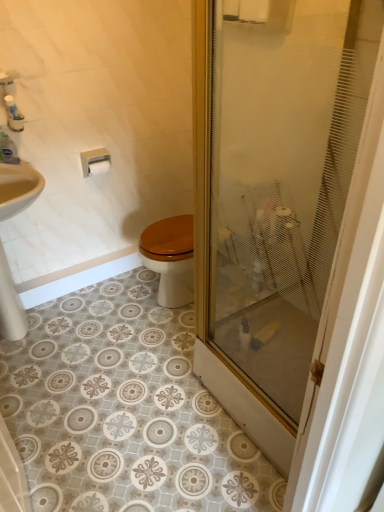
What do you see at coordinates (99, 167) in the screenshot? The width and height of the screenshot is (384, 512). I see `white matte toilet paper at upper left` at bounding box center [99, 167].

Where is `clear plastic bottle at upper left`? Image resolution: width=384 pixels, height=512 pixels. clear plastic bottle at upper left is located at coordinates (8, 150).

The height and width of the screenshot is (512, 384). In order to click on transparent frosted glass at center in this screenshot , I will do [282, 176].

In the image, is white plastic toilet paper holder at upper left positioned in front of or behind transparent frosted glass at center?

white plastic toilet paper holder at upper left is behind transparent frosted glass at center.

From the image's perspective, is white plastic toilet paper holder at upper left located above or below transparent frosted glass at center?

Clearly, from the image's perspective, white plastic toilet paper holder at upper left is above transparent frosted glass at center.

Between point (90, 170) and point (230, 99), which one is positioned behind?

The point (90, 170) is farther from the camera.

Consider the image. Could you tell me if white plastic toilet paper holder at upper left is turned towards transparent frosted glass at center?

Yes, white plastic toilet paper holder at upper left is turned towards transparent frosted glass at center.

From a real-world perspective, relative to white plastic toilet paper holder at upper left, is clear plastic bottle at upper left vertically above or below?

clear plastic bottle at upper left is situated higher than white plastic toilet paper holder at upper left in the real world.

Would you say clear plastic bottle at upper left is a long distance from white plastic toilet paper holder at upper left?

No, clear plastic bottle at upper left is not far from white plastic toilet paper holder at upper left.

In the scene shown: Is clear plastic bottle at upper left located outside white plastic toilet paper holder at upper left?

Yes, clear plastic bottle at upper left is outside of white plastic toilet paper holder at upper left.

Is clear plastic bottle at upper left turned away from white plastic toilet paper holder at upper left?

No, clear plastic bottle at upper left is not facing the opposite direction of white plastic toilet paper holder at upper left.

Consider the image. Does clear plastic bottle at upper left have a larger size compared to transparent frosted glass at center?

No, clear plastic bottle at upper left is not bigger than transparent frosted glass at center.

Is clear plastic bottle at upper left positioned far away from transparent frosted glass at center?

Yes, clear plastic bottle at upper left is far from transparent frosted glass at center.

From a real-world perspective, is clear plastic bottle at upper left over transparent frosted glass at center?

Yes, from a real-world perspective, clear plastic bottle at upper left is over transparent frosted glass at center

Where is `toiletry behind the transparent frosted glass at center`? The height and width of the screenshot is (512, 384). toiletry behind the transparent frosted glass at center is located at coordinates (8, 150).

From a real-world perspective, between transparent frosted glass at center and white plastic toilet paper holder at upper left, who is vertically higher?

From a 3D spatial view, transparent frosted glass at center is above.

Which of these two, transparent frosted glass at center or white plastic toilet paper holder at upper left, is thinner?

Thinner between the two is white plastic toilet paper holder at upper left.

Between transparent frosted glass at center and white plastic toilet paper holder at upper left, which one appears on the left side from the viewer's perspective?

white plastic toilet paper holder at upper left is more to the left.

How much distance is there between clear plastic bottle at upper left and white matte toilet paper at upper left?

clear plastic bottle at upper left and white matte toilet paper at upper left are 18.36 inches apart.

Does clear plastic bottle at upper left have a lesser width compared to white matte toilet paper at upper left?

Incorrect, the width of clear plastic bottle at upper left is not less than that of white matte toilet paper at upper left.

Is clear plastic bottle at upper left situated inside white matte toilet paper at upper left or outside?

clear plastic bottle at upper left is spatially situated outside white matte toilet paper at upper left.

Considering the sizes of objects white matte toilet paper at upper left and transparent frosted glass at center in the image provided, who is taller, white matte toilet paper at upper left or transparent frosted glass at center?

transparent frosted glass at center is taller.

From the image's perspective, is white matte toilet paper at upper left above or below transparent frosted glass at center?

Based on their image positions, white matte toilet paper at upper left is located above transparent frosted glass at center.

At what (x,y) coordinates should I click in order to perform the action: click on toilet paper above the transparent frosted glass at center (from the image's perspective). Please return your answer as a coordinate pair (x, y). The width and height of the screenshot is (384, 512). Looking at the image, I should click on (99, 167).

Which object is thinner, white matte toilet paper at upper left or transparent frosted glass at center?

With smaller width is white matte toilet paper at upper left.

Locate an element on the screen. This screenshot has height=512, width=384. towel bar lying in front of the white matte toilet paper at upper left is located at coordinates point(95,162).

Is white plastic toilet paper holder at upper left taller or shorter than white matte toilet paper at upper left?

Clearly, white plastic toilet paper holder at upper left is taller compared to white matte toilet paper at upper left.

Which is more to the left, white plastic toilet paper holder at upper left or white matte toilet paper at upper left?

white plastic toilet paper holder at upper left is more to the left.

Can you tell me how much white plastic toilet paper holder at upper left and white matte toilet paper at upper left differ in facing direction?

white plastic toilet paper holder at upper left and white matte toilet paper at upper left are facing 1.89 degrees away from each other.

Where is `glass door that is below the white plastic toilet paper holder at upper left (from the image's perspective)`? Image resolution: width=384 pixels, height=512 pixels. glass door that is below the white plastic toilet paper holder at upper left (from the image's perspective) is located at coordinates (282, 176).

This screenshot has width=384, height=512. Find the location of `towel bar behind the clear plastic bottle at upper left`. towel bar behind the clear plastic bottle at upper left is located at coordinates (95, 162).

Which object lies nearer to the anchor point transparent frosted glass at center, clear plastic bottle at upper left or white matte toilet paper at upper left?

Based on the image, clear plastic bottle at upper left appears to be nearer to transparent frosted glass at center.

Looking at this image, which object lies further to the anchor point white plastic toilet paper holder at upper left, white matte toilet paper at upper left or clear plastic bottle at upper left?

clear plastic bottle at upper left.

Looking at the image, which one is located closer to transparent frosted glass at center, clear plastic bottle at upper left or white plastic toilet paper holder at upper left?

Among the two, white plastic toilet paper holder at upper left is located nearer to transparent frosted glass at center.

When comparing their distances from transparent frosted glass at center, does white matte toilet paper at upper left or clear plastic bottle at upper left seem closer?

clear plastic bottle at upper left lies closer to transparent frosted glass at center than the other object.

Estimate the real-world distances between objects in this image. Which object is further from white matte toilet paper at upper left, clear plastic bottle at upper left or white plastic toilet paper holder at upper left?

Based on the image, clear plastic bottle at upper left appears to be further to white matte toilet paper at upper left.

Which object lies further to the anchor point white matte toilet paper at upper left, white plastic toilet paper holder at upper left or transparent frosted glass at center?

The object further to white matte toilet paper at upper left is transparent frosted glass at center.

When comparing their distances from white plastic toilet paper holder at upper left, does white matte toilet paper at upper left or transparent frosted glass at center seem closer?

white matte toilet paper at upper left is positioned closer to the anchor white plastic toilet paper holder at upper left.

From the image, which object appears to be farther from white plastic toilet paper holder at upper left, clear plastic bottle at upper left or white matte toilet paper at upper left?

Among the two, clear plastic bottle at upper left is located further to white plastic toilet paper holder at upper left.

Identify the location of towel bar located between transparent frosted glass at center and white matte toilet paper at upper left in the depth direction. This screenshot has width=384, height=512. (95, 162).

Where is `toiletry between transparent frosted glass at center and white plastic toilet paper holder at upper left along the z-axis`? This screenshot has height=512, width=384. toiletry between transparent frosted glass at center and white plastic toilet paper holder at upper left along the z-axis is located at coordinates (8, 150).

The height and width of the screenshot is (512, 384). I want to click on toiletry between transparent frosted glass at center and white matte toilet paper at upper left along the z-axis, so click(x=8, y=150).

Locate an element on the screen. towel bar between clear plastic bottle at upper left and white matte toilet paper at upper left in the horizontal direction is located at coordinates (95, 162).